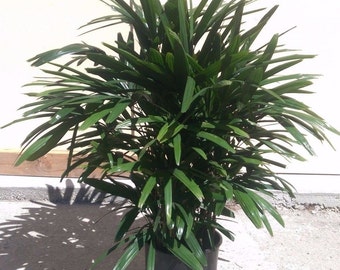
In order to click on black pot in this screenshot , I will do `click(168, 264)`.